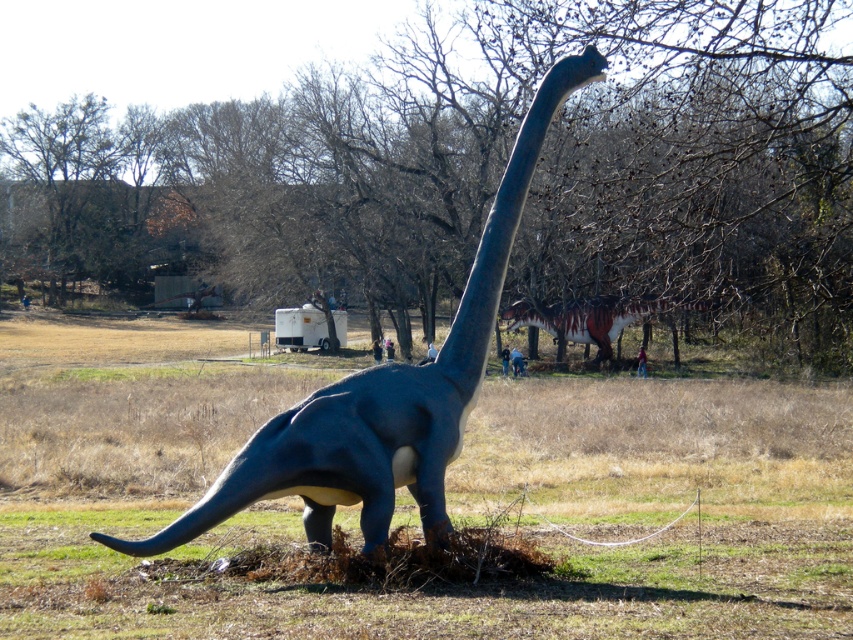
You are a tour guide leading a group of children through a dinosaur exhibit. You want to ensure that the children can hear your explanation clearly. If the sound carries up to 40 meters, will the children standing on the green grass at lower center hear you while you are next to the shiny metallic dinosaur at center?

The distance between the green grass at lower center and the shiny metallic dinosaur at center is 39.99 meters, which is just under the 40 meter limit. Therefore, the children on the green grass at lower center will be able to hear the explanation clearly.

You are standing at the center of the image and want to place a new decorative rock. The rock needs to be placed exactly at the same position as the green grass at lower center. What are the coordinates where you should place the rock?

The coordinates for the green grass at lower center are at point (x=444, y=588). Therefore, the rock should be placed at coordinates (x=444, y=588).